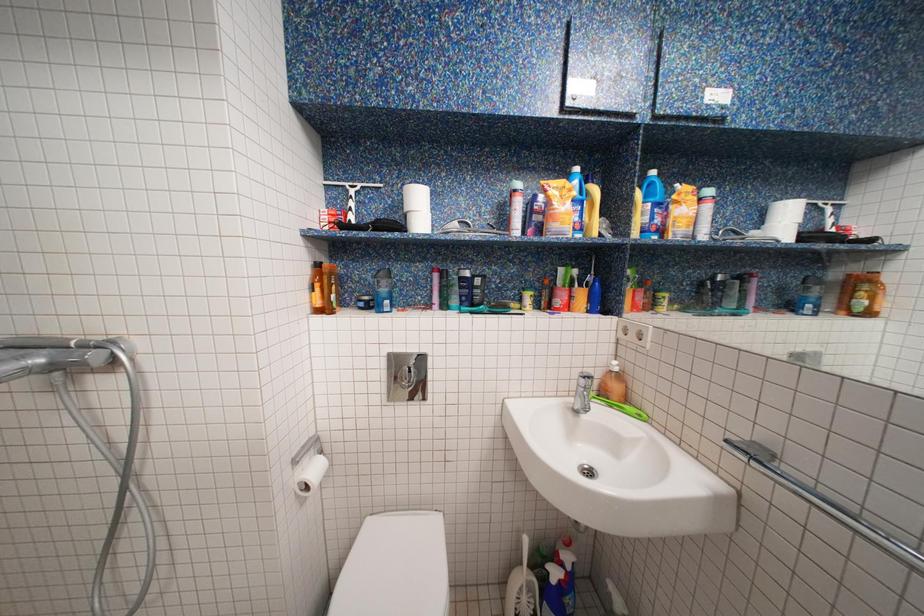
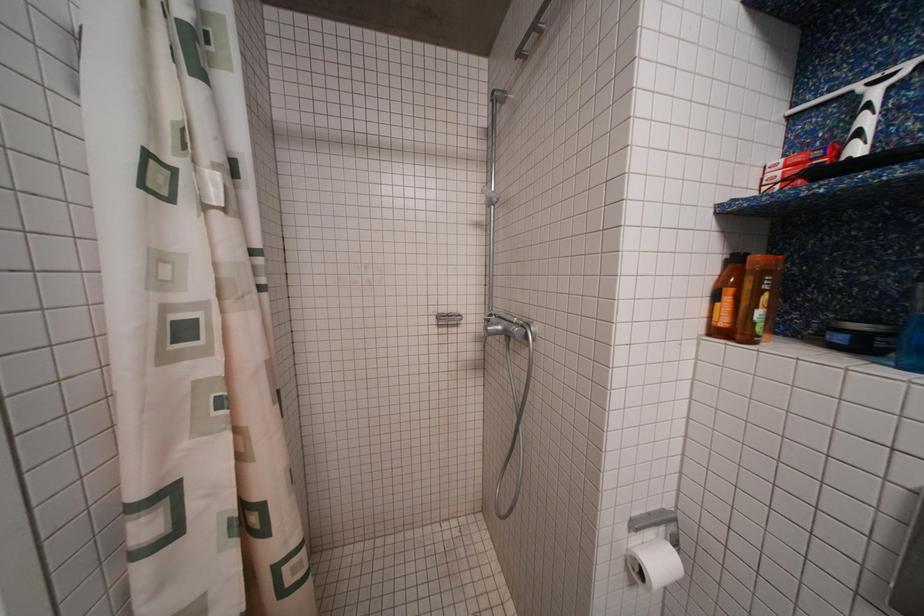
Question: How did the camera likely rotate?

Choices:
 (A) Left
 (B) Right
 (C) Up
 (D) Down

Answer: (A)